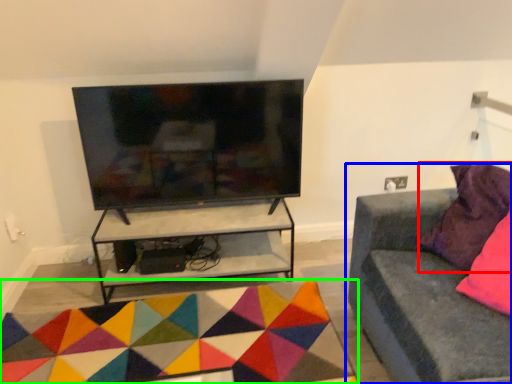
Question: Which object is the closest to the pillow (highlighted by a red box)? Choose among these: studio couch (highlighted by a blue box) or mat (highlighted by a green box).

Choices:
 (A) studio couch
 (B) mat

Answer: (A)